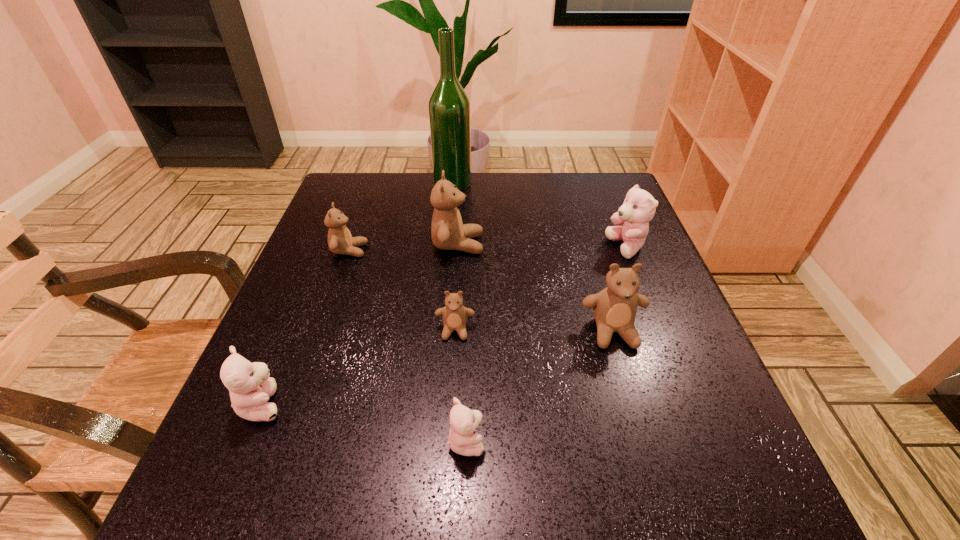
You are a GUI agent. You are given a task and a screenshot of the screen. Output one action in this format:
    pyautogui.click(x=<x>, y=<y>)
    Task: Click on the smallest pink teddy bear
    
    Given the screenshot: What is the action you would take?
    pyautogui.click(x=462, y=440)

You are a GUI agent. You are given a task and a screenshot of the screen. Output one action in this format:
    pyautogui.click(x=<x>, y=<y>)
    Task: Click on the vacant space positioned 0.070m on the front of the farthest object
    The height and width of the screenshot is (540, 960).
    Given the screenshot: What is the action you would take?
    pyautogui.click(x=450, y=207)

Find the location of a particular element. vacant region located on the front-facing side of the second tallest object is located at coordinates (639, 244).

Where is `vacant space located 0.390m at the face of the rightmost pink teddy bear`? This screenshot has height=540, width=960. vacant space located 0.390m at the face of the rightmost pink teddy bear is located at coordinates (440, 248).

Find the location of `free spot located at the face of the rightmost pink teddy bear`. free spot located at the face of the rightmost pink teddy bear is located at coordinates (466, 248).

Find the location of a particular element. The width and height of the screenshot is (960, 540). vacant area located at the face of the rightmost pink teddy bear is located at coordinates (568, 248).

This screenshot has height=540, width=960. I want to click on free space located on the front-facing side of the third smallest brown teddy bear, so click(667, 516).

Identify the location of vacant space located on the front-facing side of the leftmost brown teddy bear. (478, 251).

I want to click on vacant region located at the face of the leftmost pink teddy bear, so click(x=516, y=404).

The width and height of the screenshot is (960, 540). I want to click on vacant space situated on the front-facing side of the smallest brown teddy bear, so pos(452,378).